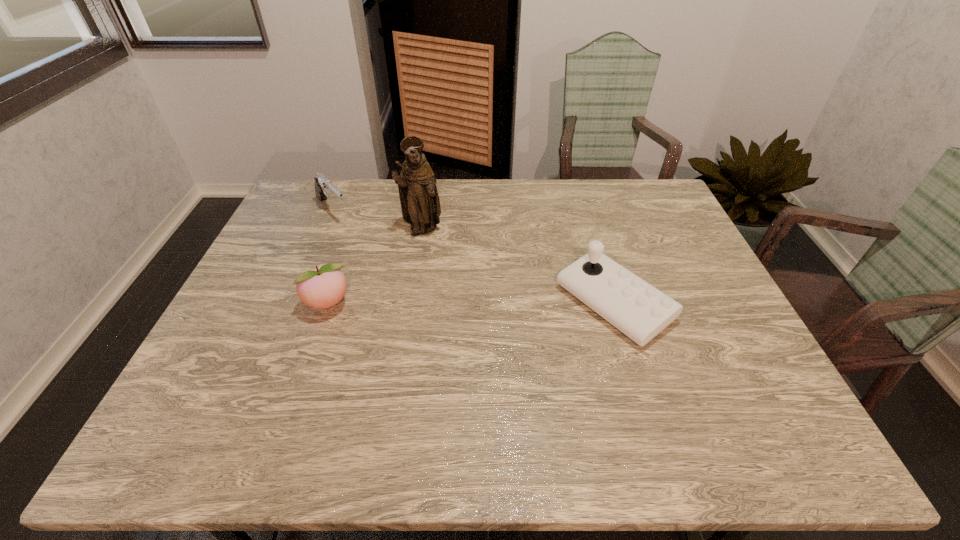
The image size is (960, 540). I want to click on free space on the desktop that is between the peach and the rightmost object and is positioned on the front-facing side of the second object from right to left, so click(x=483, y=303).

You are a GUI agent. You are given a task and a screenshot of the screen. Output one action in this format:
    pyautogui.click(x=<x>, y=<y>)
    Task: Click on the vacant spot on the desktop that is between the peach and the rightmost object and is positioned at the muzzle of the gun
    
    Given the screenshot: What is the action you would take?
    pyautogui.click(x=435, y=304)